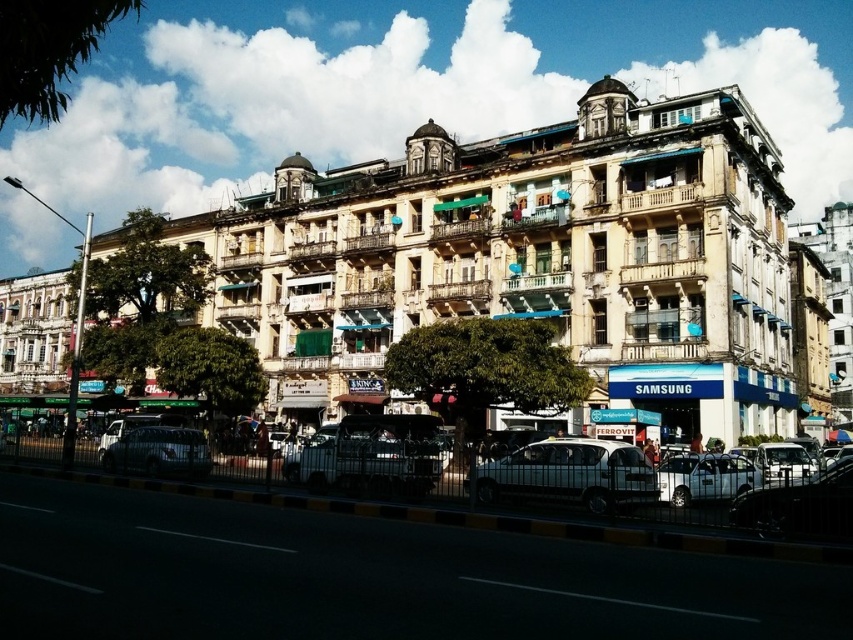
You are a delivery driver who needs to park your vehicle in the parking area in front of the large multi story building. You see a metallic silver car at center and a silver metallic sedan at center. Which vehicle should you avoid parking behind to ensure your license plate is visible to the security cameras?

You should avoid parking behind the metallic silver car at center because it is positioned over the silver metallic sedan at center, which might block the view of the sedan. However, parking behind the sedan would be safer as it is lower and less likely to obstruct your license plate.

In the scene shown: You are driving a metallic silver car at center and want to exit the parking area. Is there enough space to move forward past the silver metallic sedan at center that is blocking your path?

The silver metallic sedan at center is behind the metallic silver car at center, so there is enough space for the metallic silver car at center to move forward past the silver metallic sedan at center.

You are standing at the point marked by the coordinates (531,262) in the image. Describe the object located at this point and its relation to the parked vehicles in front of the beige stone building at center.

The point (531,262) corresponds to the beige stone building at center. The parked vehicles are positioned in front of it along the curb.